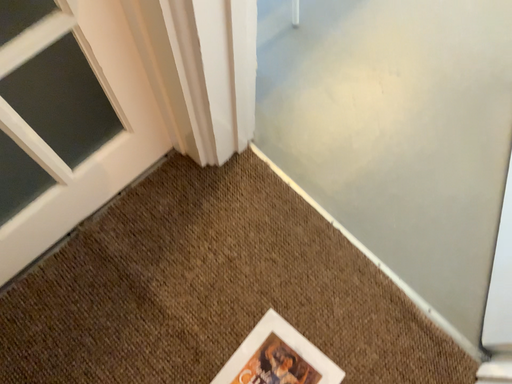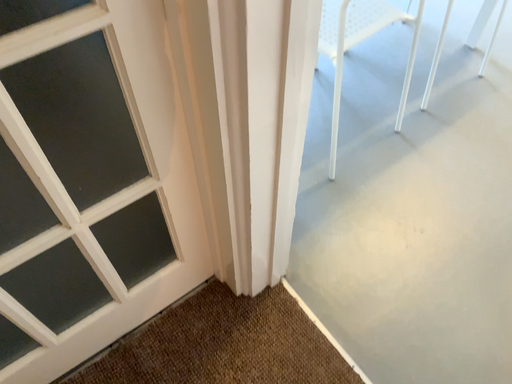
Question: Which way did the camera rotate in the video?

Choices:
 (A) rotated upward
 (B) rotated downward

Answer: (A)